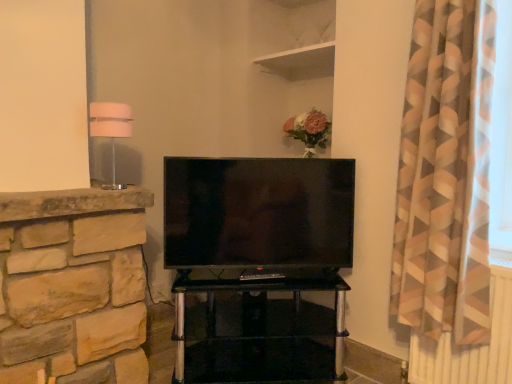
Find the location of a particular element. The height and width of the screenshot is (384, 512). matte black tv at center is located at coordinates (258, 212).

The height and width of the screenshot is (384, 512). Describe the element at coordinates (258, 212) in the screenshot. I see `matte black tv at center` at that location.

Measure the distance between point (296, 48) and camera.

A distance of 7.68 feet exists between point (296, 48) and camera.

The height and width of the screenshot is (384, 512). Describe the element at coordinates (111, 130) in the screenshot. I see `white fabric lampshade at left` at that location.

The width and height of the screenshot is (512, 384). Describe the element at coordinates (445, 174) in the screenshot. I see `geometric-patterned fabric curtain at right` at that location.

In order to click on white matte shelf at upper center, which ranks as the first shelf in bottom-to-top order in this screenshot , I will do `click(300, 62)`.

In the scene shown: Is white matte shelf at upper center, the first shelf positioned from the top, a part of matte black tv at center?

No, matte black tv at center does not contain white matte shelf at upper center, the first shelf positioned from the top.

Considering the positions of objects matte black tv at center and white matte shelf at upper center, acting as the 2th shelf starting from the bottom, in the image provided, who is behind, matte black tv at center or white matte shelf at upper center, acting as the 2th shelf starting from the bottom,?

Positioned behind is white matte shelf at upper center, acting as the 2th shelf starting from the bottom.

Is matte black tv at center not near white matte shelf at upper center, acting as the 2th shelf starting from the bottom?

matte black tv at center is actually quite close to white matte shelf at upper center, acting as the 2th shelf starting from the bottom.

Considering the sizes of matte black tv at center and white matte shelf at upper center, the first shelf positioned from the top, in the image, is matte black tv at center wider or thinner than white matte shelf at upper center, the first shelf positioned from the top,?

Considering their sizes, matte black tv at center looks slimmer than white matte shelf at upper center, the first shelf positioned from the top.

Which object is wider, white matte shelf at upper center, which ranks as the first shelf in bottom-to-top order, or white matte shelf at upper center, the first shelf positioned from the top?

Wider between the two is white matte shelf at upper center, which ranks as the first shelf in bottom-to-top order.

The width and height of the screenshot is (512, 384). There is a white matte shelf at upper center, which ranks as the first shelf in bottom-to-top order. What are the coordinates of `shelf above it (from a real-world perspective)` in the screenshot? It's located at (305, 42).

Does white matte shelf at upper center, acting as the 2th shelf starting from the top, turn towards white matte shelf at upper center, the first shelf positioned from the top?

No, white matte shelf at upper center, acting as the 2th shelf starting from the top, does not turn towards white matte shelf at upper center, the first shelf positioned from the top.

Considering the points (310, 45) and (109, 128), which point is in front, point (310, 45) or point (109, 128)?

The point (109, 128) is closer to the camera.

From the picture: Is white matte shelf at upper center, acting as the 2th shelf starting from the bottom, touching white fabric lampshade at left?

No.

Is white matte shelf at upper center, the first shelf positioned from the top, positioned beyond the bounds of white fabric lampshade at left?

That's correct, white matte shelf at upper center, the first shelf positioned from the top, is outside of white fabric lampshade at left.

Is white matte shelf at upper center, acting as the 2th shelf starting from the bottom, facing away from white fabric lampshade at left?

No, white matte shelf at upper center, acting as the 2th shelf starting from the bottom,'s orientation is not away from white fabric lampshade at left.

Considering the positions of points (344, 230) and (422, 319), is point (344, 230) farther from camera compared to point (422, 319)?

Yes, it is.

Who is taller, matte black tv at center or geometric-patterned fabric curtain at right?

geometric-patterned fabric curtain at right is taller.

Is matte black tv at center looking in the opposite direction of geometric-patterned fabric curtain at right?

No.

Does point (477, 18) come closer to viewer compared to point (327, 200)?

Yes, it is in front of point (327, 200).

At what (x,y) coordinates should I click in order to perform the action: click on curtain above the matte black tv at center (from a real-world perspective). Please return your answer as a coordinate pair (x, y). Looking at the image, I should click on (445, 174).

Can you see geometric-patterned fabric curtain at right touching matte black tv at center?

No, geometric-patterned fabric curtain at right is not touching matte black tv at center.

Considering the relative positions of geometric-patterned fabric curtain at right and matte black tv at center in the image provided, is geometric-patterned fabric curtain at right to the left or to the right of matte black tv at center?

Based on their positions, geometric-patterned fabric curtain at right is located to the right of matte black tv at center.

Is white matte shelf at upper center, the first shelf positioned from the top, oriented towards transparent glass tv stand at center?

No, white matte shelf at upper center, the first shelf positioned from the top, is not oriented towards transparent glass tv stand at center.

Is there a large distance between white matte shelf at upper center, acting as the 2th shelf starting from the bottom, and transparent glass tv stand at center?

white matte shelf at upper center, acting as the 2th shelf starting from the bottom, is positioned a significant distance from transparent glass tv stand at center.

Is white matte shelf at upper center, acting as the 2th shelf starting from the bottom, to the left of transparent glass tv stand at center from the viewer's perspective?

No, white matte shelf at upper center, acting as the 2th shelf starting from the bottom, is not to the left of transparent glass tv stand at center.

Considering the relative positions of transparent glass tv stand at center and white matte shelf at upper center, acting as the 2th shelf starting from the bottom, in the image provided, is transparent glass tv stand at center to the left of white matte shelf at upper center, acting as the 2th shelf starting from the bottom, from the viewer's perspective?

Correct, you'll find transparent glass tv stand at center to the left of white matte shelf at upper center, acting as the 2th shelf starting from the bottom.

Does point (298, 300) come closer to viewer compared to point (307, 68)?

That is True.

Is transparent glass tv stand at center looking in the opposite direction of white matte shelf at upper center, the first shelf positioned from the top?

No, transparent glass tv stand at center's orientation is not away from white matte shelf at upper center, the first shelf positioned from the top.

Is transparent glass tv stand at center inside the boundaries of white matte shelf at upper center, the first shelf positioned from the top, or outside?

transparent glass tv stand at center is outside white matte shelf at upper center, the first shelf positioned from the top.

Locate an element on the screen. the 1st shelf to the right when counting from the matte black tv at center is located at coordinates (305, 42).

Identify the location of shelf above the white matte shelf at upper center, which ranks as the first shelf in bottom-to-top order (from a real-world perspective). (305, 42).

From the image, which object appears to be nearer to geometric-patterned fabric curtain at right, white matte shelf at upper center, the first shelf positioned from the top, or white fabric lampshade at left?

Based on the image, white matte shelf at upper center, the first shelf positioned from the top, appears to be nearer to geometric-patterned fabric curtain at right.

In the scene shown: Estimate the real-world distances between objects in this image. Which object is further from white matte shelf at upper center, acting as the 2th shelf starting from the top, geometric-patterned fabric curtain at right or transparent glass tv stand at center?

The object further to white matte shelf at upper center, acting as the 2th shelf starting from the top, is transparent glass tv stand at center.

Estimate the real-world distances between objects in this image. Which object is closer to white matte shelf at upper center, acting as the 2th shelf starting from the bottom, white fabric lampshade at left or geometric-patterned fabric curtain at right?

geometric-patterned fabric curtain at right is closer to white matte shelf at upper center, acting as the 2th shelf starting from the bottom.

When comparing their distances from geometric-patterned fabric curtain at right, does white fabric lampshade at left or matte black tv at center seem closer?

Based on the image, matte black tv at center appears to be nearer to geometric-patterned fabric curtain at right.

Considering their positions, is matte black tv at center positioned closer to white matte shelf at upper center, acting as the 2th shelf starting from the bottom, than geometric-patterned fabric curtain at right?

matte black tv at center.

Considering their positions, is transparent glass tv stand at center positioned further to white matte shelf at upper center, acting as the 2th shelf starting from the top, than geometric-patterned fabric curtain at right?

Among the two, transparent glass tv stand at center is located further to white matte shelf at upper center, acting as the 2th shelf starting from the top.

From the image, which object appears to be farther from white fabric lampshade at left, transparent glass tv stand at center or white matte shelf at upper center, the first shelf positioned from the top?

transparent glass tv stand at center is positioned further to the anchor white fabric lampshade at left.

Which object lies nearer to the anchor point matte black tv at center, white matte shelf at upper center, acting as the 2th shelf starting from the top, or white matte shelf at upper center, acting as the 2th shelf starting from the bottom?

white matte shelf at upper center, acting as the 2th shelf starting from the top, is closer to matte black tv at center.

The height and width of the screenshot is (384, 512). What are the coordinates of `television between white fabric lampshade at left and transparent glass tv stand at center in the up-down direction` in the screenshot? It's located at (258, 212).

Locate an element on the screen. This screenshot has width=512, height=384. curtain that lies between white matte shelf at upper center, the first shelf positioned from the top, and transparent glass tv stand at center from top to bottom is located at coordinates (445, 174).

I want to click on television that lies between white matte shelf at upper center, the first shelf positioned from the top, and transparent glass tv stand at center from top to bottom, so click(x=258, y=212).

The image size is (512, 384). In order to click on shelf positioned between geometric-patterned fabric curtain at right and white matte shelf at upper center, the first shelf positioned from the top, from near to far in this screenshot , I will do `click(300, 62)`.